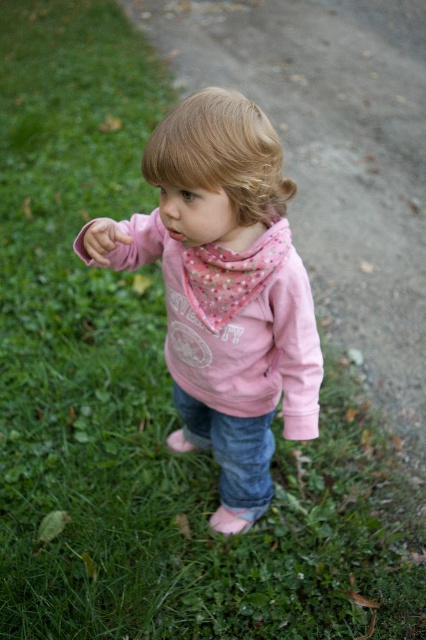
Question: Among these points, which one is farthest from the camera?

Choices:
 (A) (229, 419)
 (B) (311, 316)

Answer: (A)

Question: Is pink cotton hoodie at center behind denim jeans at lower center?

Choices:
 (A) yes
 (B) no

Answer: (B)

Question: Which object is farther from the camera taking this photo?

Choices:
 (A) blonde silky hair at center
 (B) pink cotton hoodie at center

Answer: (B)

Question: Is blonde silky hair at center to the left of denim jeans at lower center from the viewer's perspective?

Choices:
 (A) no
 (B) yes

Answer: (A)

Question: Which point appears farthest from the camera in this image?

Choices:
 (A) (120, 232)
 (B) (224, 102)

Answer: (A)

Question: Is blonde silky hair at center thinner than matte pink hand at center?

Choices:
 (A) yes
 (B) no

Answer: (B)